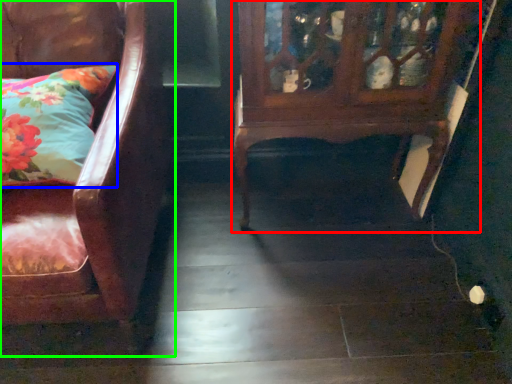
Question: Estimate the real-world distances between objects in this image. Which object is farther from furniture (highlighted by a red box), pillow (highlighted by a blue box) or chair (highlighted by a green box)?

Choices:
 (A) pillow
 (B) chair

Answer: (A)